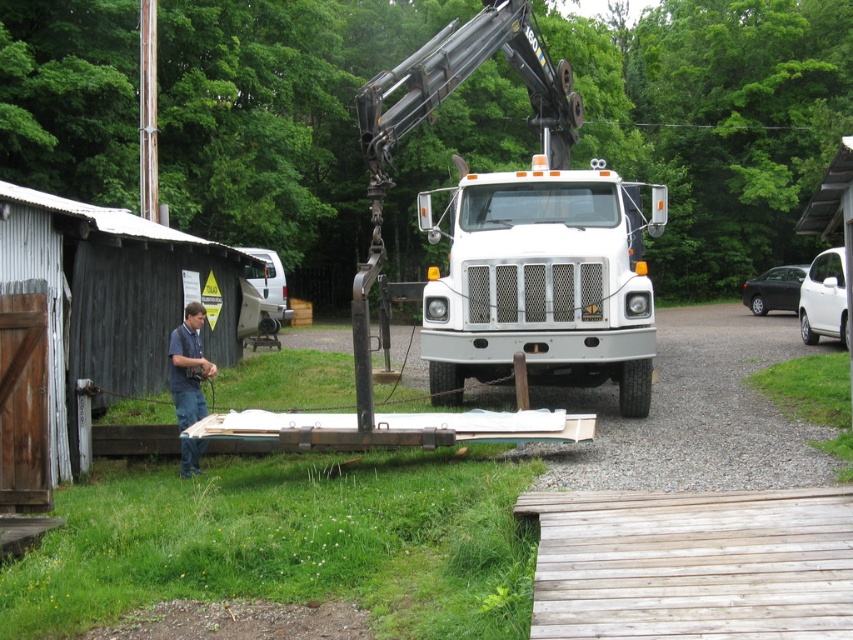
You are a delivery person trying to park your car next to the blue jeans at left. The white matte truck at center is already parked there. Can you park your car on the same driveway without overlapping with the truck?

The white matte truck at center is wider than the blue jeans at left, so if the driveway is narrow, the truck might block parking space. Check the available space before attempting to park.

You are a delivery driver who needs to park your truck in the driveway shown in the image. The parking spot is marked at coordinates point 0.441, 0.637. Is the white matte truck at center already occupying the parking spot?

Yes, the white matte truck at center is already occupying the parking spot at point [543,282] as stated in the object description.

You are standing at the point marked by coordinates point (543, 282) in the image. What object are you directly at?

You are directly at the white matte truck at center marked by point (543, 282).